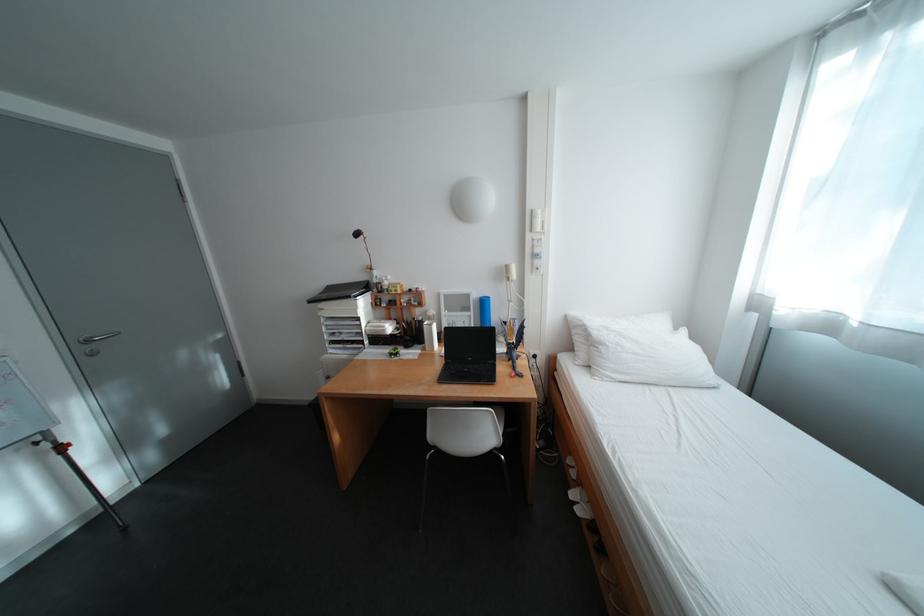
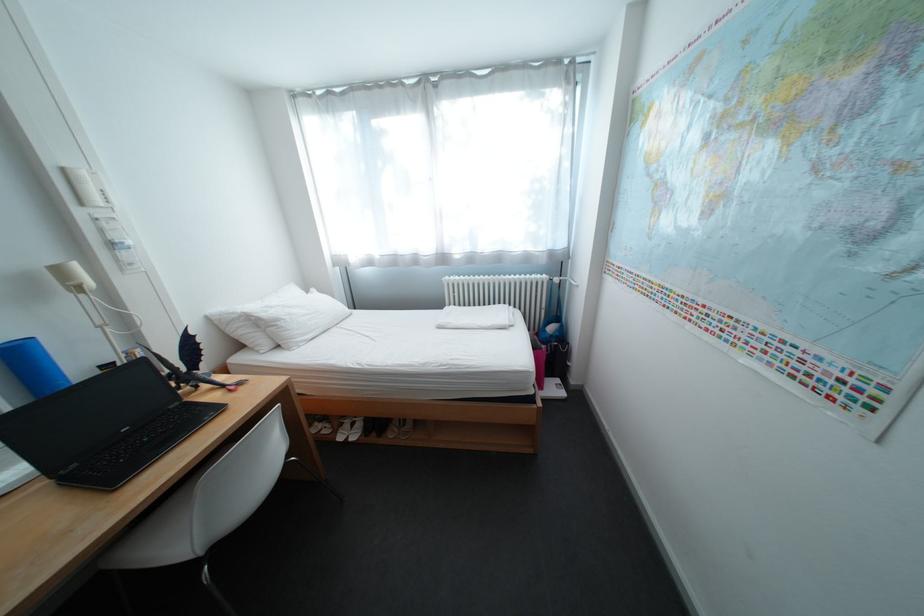
In the second image, find the point that corresponds to point (544, 213) in the first image.

(76, 171)